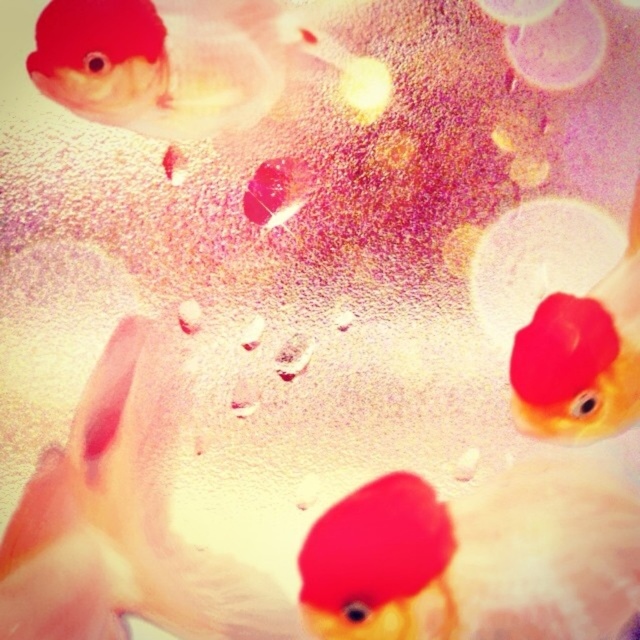
Question: Does matte red goldfish at center come in front of matte goldfish at upper right?

Choices:
 (A) yes
 (B) no

Answer: (A)

Question: Can you confirm if matte red goldfish at upper right is positioned to the left of matte goldfish at upper right?

Choices:
 (A) yes
 (B) no

Answer: (A)

Question: From the image, what is the correct spatial relationship of matte red goldfish at center in relation to matte goldfish at upper right?

Choices:
 (A) right
 (B) left

Answer: (B)

Question: Which of these objects is positioned farthest from the matte goldfish at upper right?

Choices:
 (A) matte red goldfish at center
 (B) matte red goldfish at upper right

Answer: (A)

Question: Which point is farther from the camera taking this photo?

Choices:
 (A) pyautogui.click(x=593, y=432)
 (B) pyautogui.click(x=186, y=42)
 (C) pyautogui.click(x=372, y=628)
 (D) pyautogui.click(x=412, y=611)

Answer: (B)

Question: Which point is closer to the camera?

Choices:
 (A) matte goldfish at upper right
 (B) matte red goldfish at center
 (C) matte red goldfish at upper right
 (D) matte goldfish at upper left

Answer: (C)